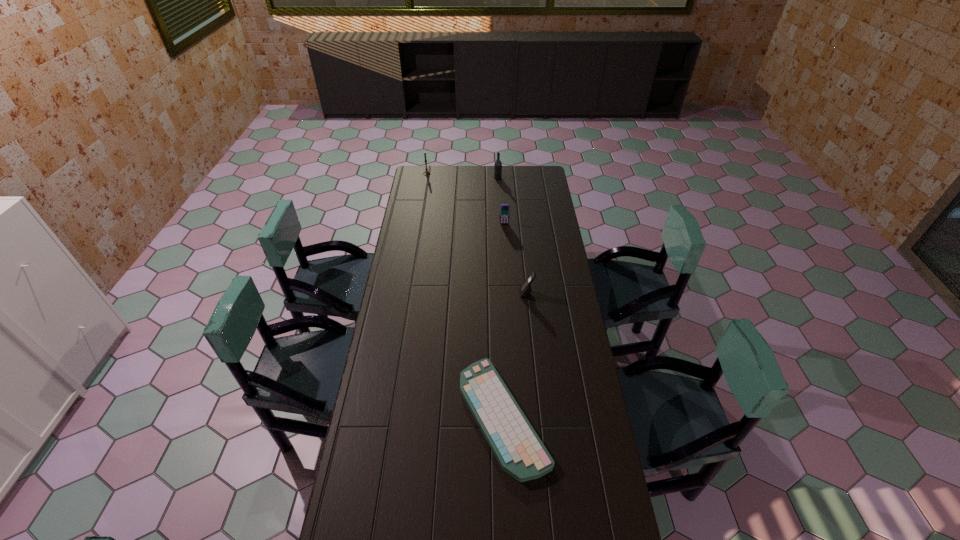
Where is `blank region between the vodka and the computer keyboard`? The width and height of the screenshot is (960, 540). blank region between the vodka and the computer keyboard is located at coordinates (500, 297).

Select which object appears as the closest to the nearer cellular telephone. Please provide its 2D coordinates. Your answer should be formatted as a tuple, i.e. [(x, y)], where the tuple contains the x and y coordinates of a point satisfying the conditions above.

[(517, 447)]

In order to click on the closest object relative to the computer keyboard in this screenshot , I will do `click(525, 289)`.

Locate an element on the screen. The height and width of the screenshot is (540, 960). free space that satisfies the following two spatial constraints: 1. on the front side of the vodka; 2. on the right side of the farthest object is located at coordinates (426, 178).